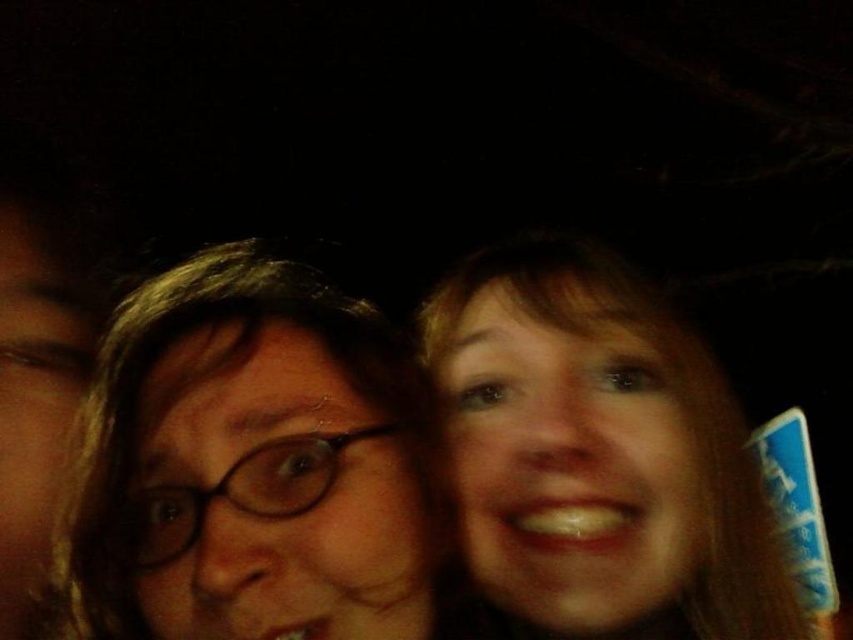
Does matte brown hair at center have a larger size compared to smooth skin face at right?

Yes, matte brown hair at center is bigger than smooth skin face at right.

Between matte brown hair at center and smooth skin face at right, which one has more height?

With more height is smooth skin face at right.

Which is in front, point (263, 614) or point (524, 346)?

Point (263, 614) is in front.

The height and width of the screenshot is (640, 853). Find the location of `matte brown hair at center`. matte brown hair at center is located at coordinates (254, 465).